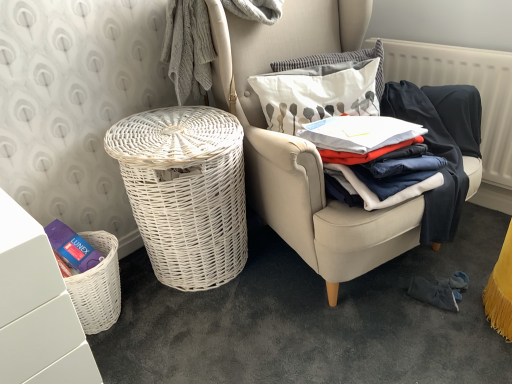
Question: Does point (35, 263) appear closer or farther from the camera than point (209, 127)?

Choices:
 (A) farther
 (B) closer

Answer: (B)

Question: Which is correct: white matte vanity at lower left is inside white wicker basket at left, or outside of it?

Choices:
 (A) outside
 (B) inside

Answer: (A)

Question: Which object is positioned farthest from the white fabric pillow at upper right, the second pillow in the top-to-bottom sequence?

Choices:
 (A) white textured radiator at upper right
 (B) white wicker basket at left
 (C) white wicker chair at center
 (D) white matte vanity at lower left
 (E) dark blue cotton clothes at center right

Answer: (D)

Question: Which of these objects is positioned farthest from the dark blue cotton clothes at center right?

Choices:
 (A) white wicker basket at left
 (B) white textured radiator at upper right
 (C) white matte vanity at lower left
 (D) white fabric pillow at upper right, the second pillow in the top-to-bottom sequence
 (E) white textured pillow at upper center, arranged as the first pillow when viewed from the top

Answer: (C)